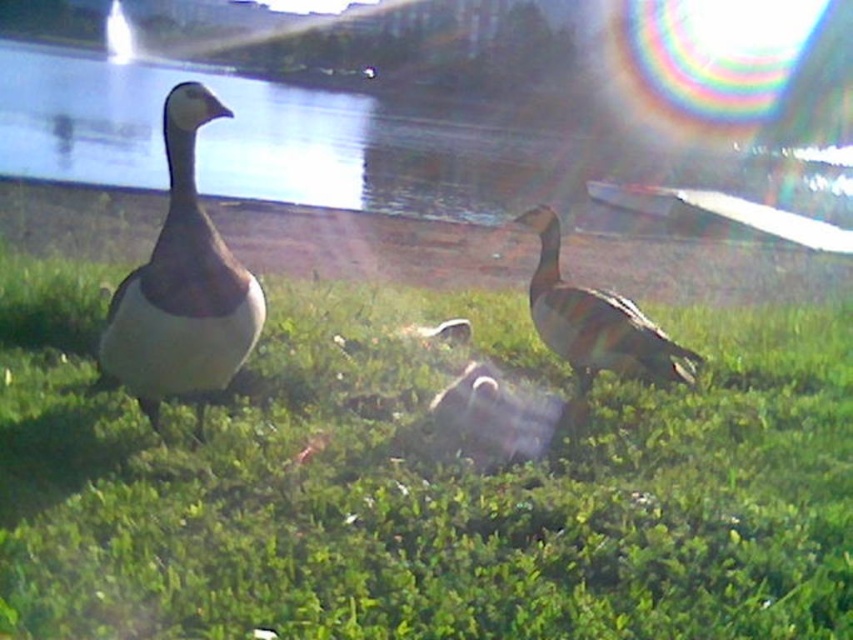
Between point (64, 532) and point (582, 376), which one is positioned behind?

The point (582, 376) is more distant.

Is green grassy at center above brown striped duck at center?

No.

The width and height of the screenshot is (853, 640). Describe the element at coordinates (421, 483) in the screenshot. I see `green grassy at center` at that location.

Find the location of `green grassy at center`. green grassy at center is located at coordinates (421, 483).

Does green grassy at center have a greater width compared to transparent glass water at center?

No.

Who is taller, green grassy at center or transparent glass water at center?

With more height is transparent glass water at center.

Is point (445, 364) positioned in front of point (552, 125)?

Yes, point (445, 364) is in front of point (552, 125).

You are a GUI agent. You are given a task and a screenshot of the screen. Output one action in this format:
    pyautogui.click(x=<x>, y=<y>)
    Task: Click on the green grassy at center
    This screenshot has height=640, width=853.
    Given the screenshot: What is the action you would take?
    pyautogui.click(x=421, y=483)

Does green grassy at center appear on the left side of white matte duck at left?

Incorrect, green grassy at center is not on the left side of white matte duck at left.

Is green grassy at center positioned at the back of white matte duck at left?

No, green grassy at center is closer to the viewer.

Which is in front, point (259, 408) or point (192, 86)?

Point (192, 86) is more forward.

This screenshot has width=853, height=640. Identify the location of green grassy at center. (421, 483).